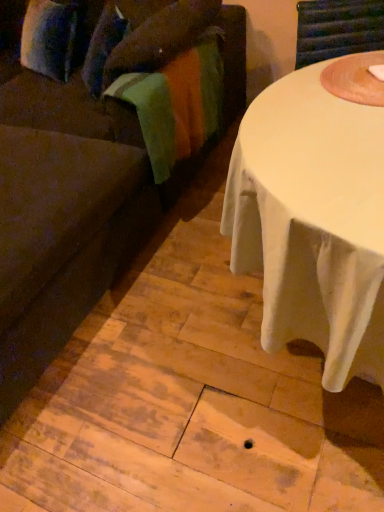
Question: Is brown fabric couch at left at the left side of velvety green blanket at left?

Choices:
 (A) yes
 (B) no

Answer: (A)

Question: Is brown fabric couch at left behind velvety green blanket at left?

Choices:
 (A) yes
 (B) no

Answer: (B)

Question: Can you confirm if brown fabric couch at left is bigger than velvety green blanket at left?

Choices:
 (A) yes
 (B) no

Answer: (A)

Question: Can you confirm if brown fabric couch at left is taller than velvety green blanket at left?

Choices:
 (A) no
 (B) yes

Answer: (B)

Question: Does brown fabric couch at left have a smaller size compared to velvety green blanket at left?

Choices:
 (A) yes
 (B) no

Answer: (B)

Question: Is brown fabric couch at left at the right side of velvety green blanket at left?

Choices:
 (A) no
 (B) yes

Answer: (A)

Question: Does velvety green blanket at left appear on the left side of brown fabric couch at left?

Choices:
 (A) no
 (B) yes

Answer: (A)

Question: Is velvety green blanket at left facing away from brown fabric couch at left?

Choices:
 (A) yes
 (B) no

Answer: (A)

Question: Is velvety green blanket at left not close to brown fabric couch at left?

Choices:
 (A) no
 (B) yes

Answer: (A)

Question: From the image's perspective, is velvety green blanket at left on top of brown fabric couch at left?

Choices:
 (A) no
 (B) yes

Answer: (B)

Question: Considering the relative sizes of velvety green blanket at left and brown fabric couch at left in the image provided, is velvety green blanket at left thinner than brown fabric couch at left?

Choices:
 (A) yes
 (B) no

Answer: (A)

Question: Is velvety green blanket at left bigger than brown fabric couch at left?

Choices:
 (A) yes
 (B) no

Answer: (B)

Question: Is brown fabric couch at left taller or shorter than velvety green blanket at left?

Choices:
 (A) short
 (B) tall

Answer: (B)